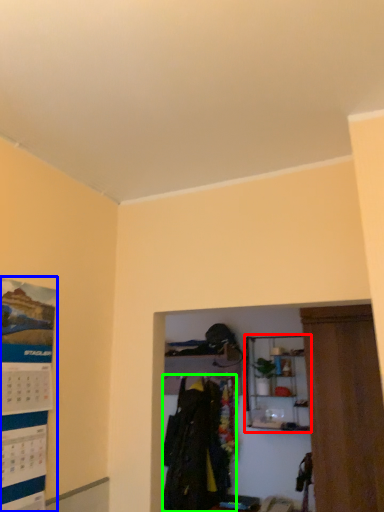
Question: Which object is the farthest from shelf (highlighted by a red box)? Choose among these: poster page (highlighted by a blue box) or clothing (highlighted by a green box).

Choices:
 (A) poster page
 (B) clothing

Answer: (A)